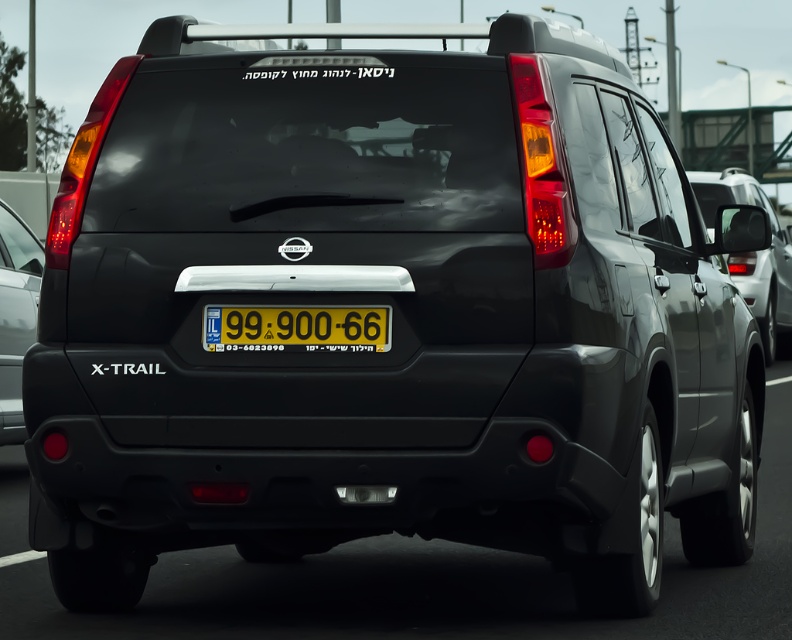
Question: Does satin black suv at right appear on the right side of matte black tail light at lower left?

Choices:
 (A) no
 (B) yes

Answer: (B)

Question: Can you confirm if satin black suv at right is wider than matte black tail light at lower left?

Choices:
 (A) yes
 (B) no

Answer: (A)

Question: Among these points, which one is nearest to the camera?

Choices:
 (A) (360, 310)
 (B) (764, 257)
 (C) (32, 292)

Answer: (A)

Question: Among these points, which one is farthest from the camera?

Choices:
 (A) (718, 189)
 (B) (29, 273)
 (C) (284, 340)

Answer: (A)

Question: Estimate the real-world distances between objects in this image. Which object is farther from the yellow plastic license plate at center?

Choices:
 (A) satin black suv at right
 (B) matte black tail light at lower left

Answer: (A)

Question: Is yellow plastic license plate at center bigger than matte black tail light at lower left?

Choices:
 (A) yes
 (B) no

Answer: (B)